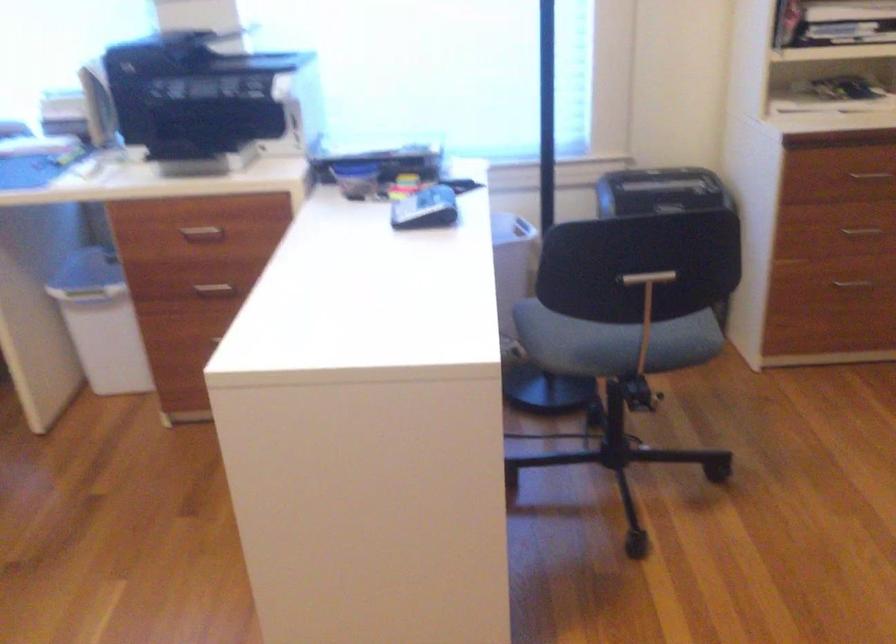
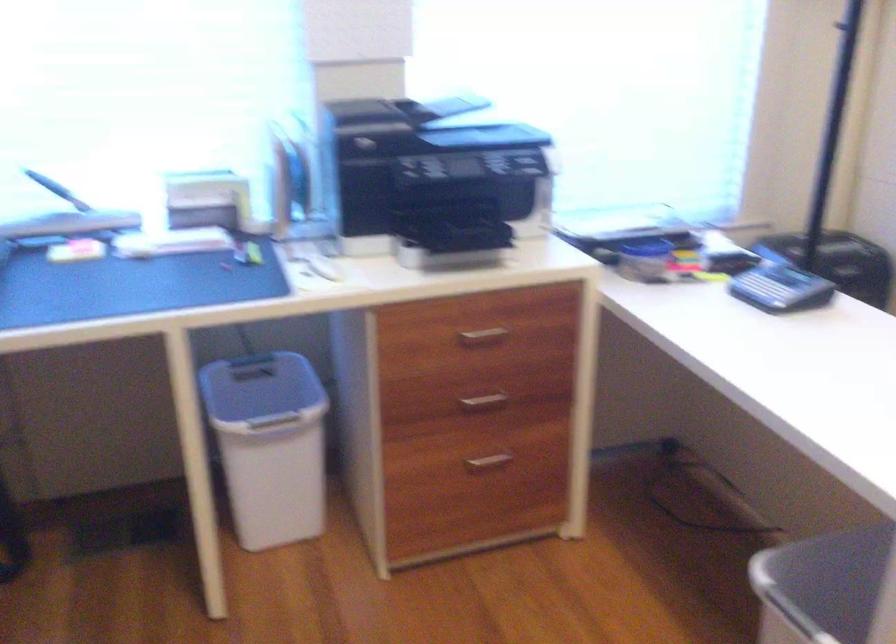
Find the pixel in the second image that matches (x=423, y=203) in the first image.

(780, 288)